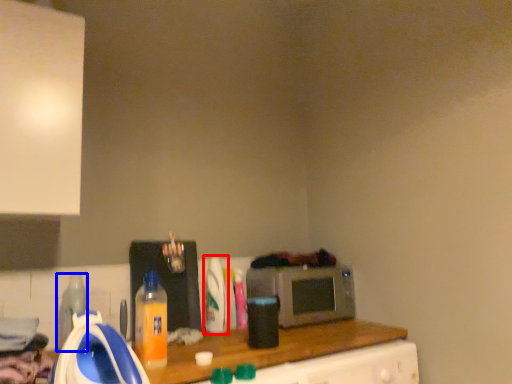
Question: Which of the following is the closest to the observer, bottle (highlighted by a red box) or bottle (highlighted by a blue box)?

Choices:
 (A) bottle
 (B) bottle

Answer: (B)